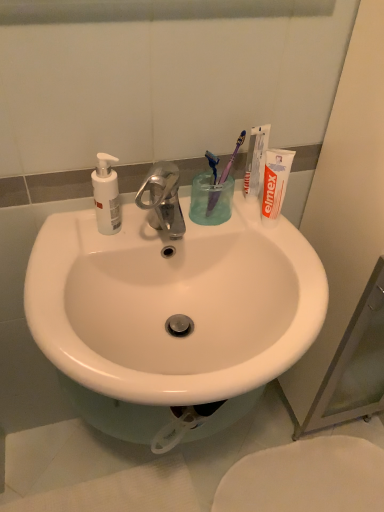
Question: Is white matte soap dispenser at left facing towards white glossy sink at center?

Choices:
 (A) yes
 (B) no

Answer: (B)

Question: Is white matte soap dispenser at left closer to the viewer compared to white glossy sink at center?

Choices:
 (A) no
 (B) yes

Answer: (A)

Question: From the image's perspective, would you say white matte soap dispenser at left is shown under white glossy sink at center?

Choices:
 (A) no
 (B) yes

Answer: (A)

Question: From the image's perspective, is white matte soap dispenser at left on top of white glossy sink at center?

Choices:
 (A) no
 (B) yes

Answer: (B)

Question: Is white matte soap dispenser at left outside white glossy sink at center?

Choices:
 (A) yes
 (B) no

Answer: (A)

Question: Considering their positions, is white glossy sink at center located in front of or behind transparent plastic cup at center?

Choices:
 (A) behind
 (B) front

Answer: (B)

Question: From their relative heights in the image, would you say white glossy sink at center is taller or shorter than transparent plastic cup at center?

Choices:
 (A) tall
 (B) short

Answer: (A)

Question: From a real-world perspective, relative to transparent plastic cup at center, is white glossy sink at center vertically above or below?

Choices:
 (A) below
 (B) above

Answer: (A)

Question: Looking at the image, does white glossy sink at center seem bigger or smaller compared to transparent plastic cup at center?

Choices:
 (A) small
 (B) big

Answer: (B)

Question: Based on their sizes in the image, would you say white matte toothpaste at upper right is bigger or smaller than purple plastic toothbrush at upper center, which appears as the 2th toothbrush when viewed from the right?

Choices:
 (A) big
 (B) small

Answer: (A)

Question: In the image, is white matte toothpaste at upper right positioned in front of or behind purple plastic toothbrush at upper center, which appears as the 2th toothbrush when viewed from the right?

Choices:
 (A) front
 (B) behind

Answer: (B)

Question: From the image's perspective, is white matte toothpaste at upper right positioned above or below purple plastic toothbrush at upper center, which appears as the first toothbrush when viewed from the left?

Choices:
 (A) below
 (B) above

Answer: (B)

Question: Is point (246, 158) closer or farther from the camera than point (210, 200)?

Choices:
 (A) farther
 (B) closer

Answer: (B)

Question: Considering the positions of point (110, 311) and point (367, 441), is point (110, 311) closer or farther from the camera than point (367, 441)?

Choices:
 (A) closer
 (B) farther

Answer: (A)

Question: Is white glossy sink at center to the left or to the right of white glossy toilet at lower right in the image?

Choices:
 (A) left
 (B) right

Answer: (A)